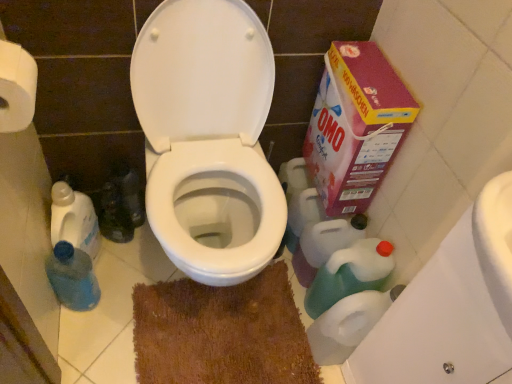
Identify the location of vacant area that lies between blue plastic bottle at lower left, marked as the 2th cleaning product in a left-to-right arrangement, and brown textured bath mat at center. (114, 324).